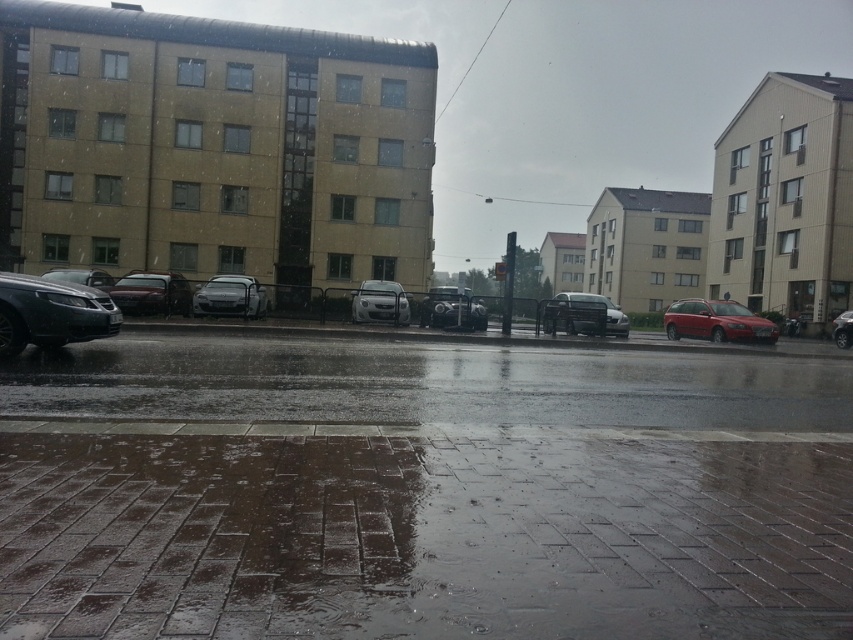
Can you confirm if metallic silver van at center is positioned above satin silver car at center?

Yes.

Measure the distance between point (619, 330) and camera.

Point (619, 330) is 28.70 meters from camera.

The image size is (853, 640). In order to click on metallic silver van at center in this screenshot , I will do `click(584, 314)`.

Describe the element at coordinates (421, 492) in the screenshot. The width and height of the screenshot is (853, 640). I see `wet brick pavement at center` at that location.

Does wet brick pavement at center have a lesser height compared to metallic silver van at center?

Correct, wet brick pavement at center is not as tall as metallic silver van at center.

Describe the element at coordinates (421, 492) in the screenshot. I see `wet brick pavement at center` at that location.

This screenshot has height=640, width=853. What are the coordinates of `wet brick pavement at center` in the screenshot? It's located at (421, 492).

Between point (12, 342) and point (161, 292), which one is positioned in front?

Point (12, 342) is in front.

Who is shorter, shiny black sedan at left or shiny metallic car at center?

With less height is shiny black sedan at left.

Does point (9, 284) come in front of point (172, 280)?

Yes.

I want to click on shiny black sedan at left, so click(51, 314).